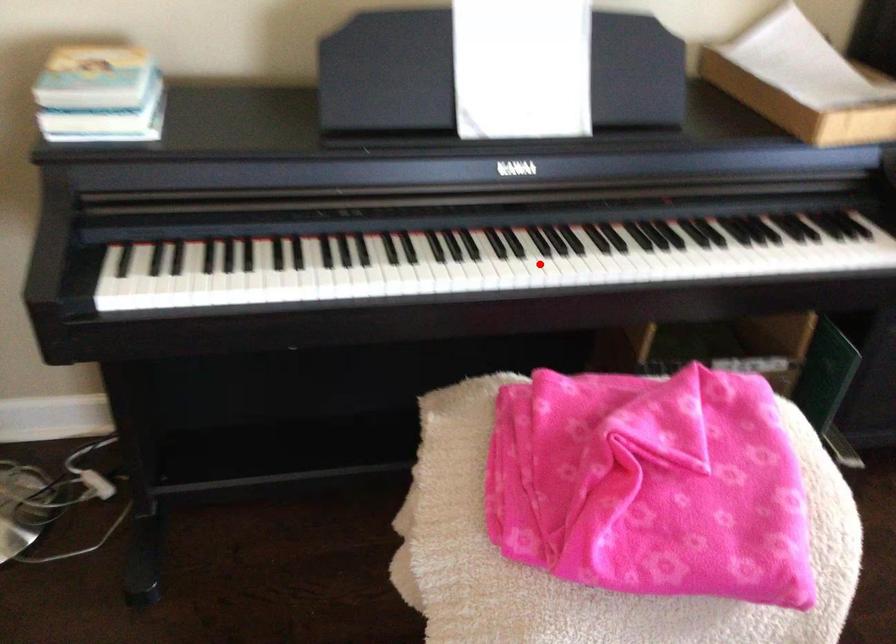
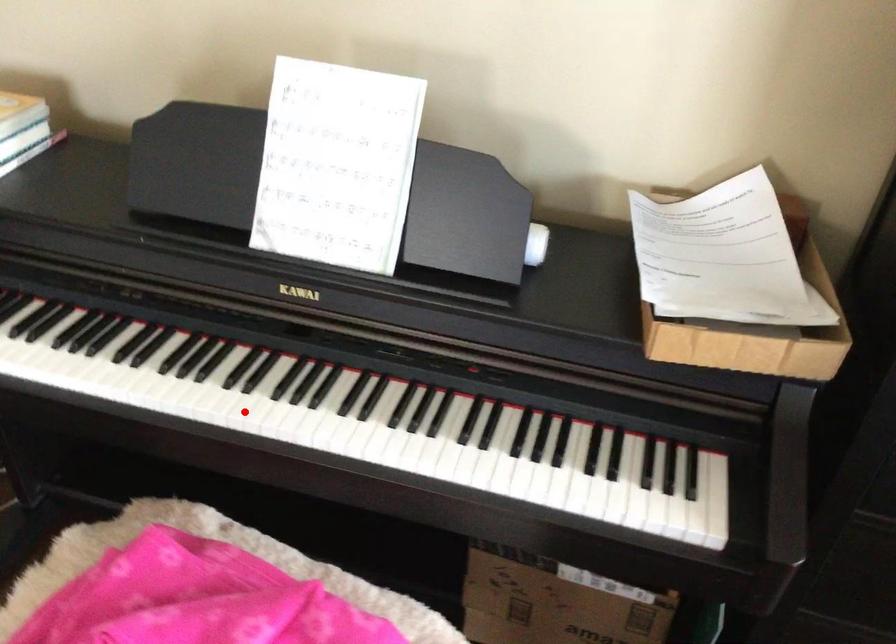
I am providing you with two images of the same scene from different viewpoints. A red point is marked on the first image and another point is marked on the second image. Are the points marked in image1 and image2 representing the same 3D position?

Yes